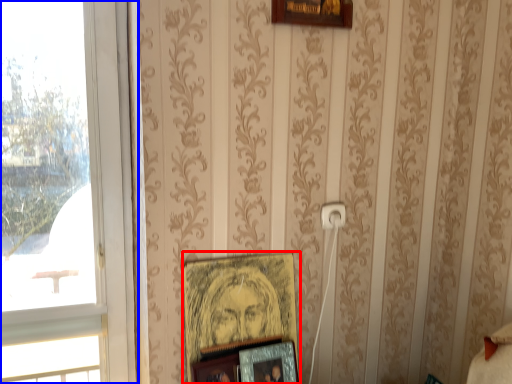
Question: Which of the following is the farthest to the observer, picture frame (highlighted by a red box) or window (highlighted by a blue box)?

Choices:
 (A) picture frame
 (B) window

Answer: (A)